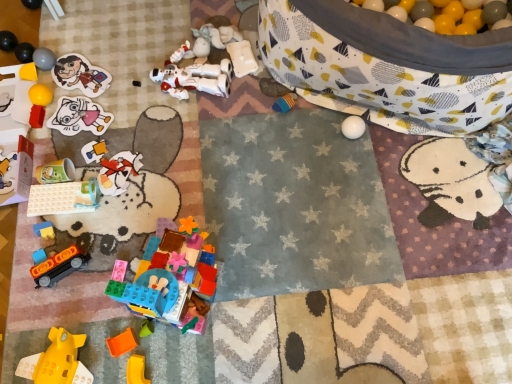
Question: From a real-world perspective, is matte paper sticker at upper left, positioned as the eleventh toy in bottom-to-top order, above or below matte plastic cup at lower left, positioned as the 9th toy in bottom-to-top order?

Choices:
 (A) below
 (B) above

Answer: (A)

Question: Would you say matte paper sticker at upper left, which ranks as the seventh toy in top-to-bottom order, is to the left or to the right of matte plastic cup at lower left, placed as the ninth toy when sorted from top to bottom, in the picture?

Choices:
 (A) left
 (B) right

Answer: (B)

Question: Which is farther from the translucent plastic cup at left, which appears as the eighth toy when viewed from the top?

Choices:
 (A) orange plastic block at lower left, the 3th toy positioned from the bottom
 (B) matte red toy at left, marked as the 6th toy in a top-to-bottom arrangement
 (C) matte gray ball at upper left, marked as the 3th toy in a top-to-bottom arrangement
 (D) translucent yellow plastic toy at lower left, arranged as the fourth toy when ordered from the bottom
 (E) white plastic building blocks at lower left, acting as the 8th toy starting from the bottom

Answer: (D)

Question: Which is nearer to the translucent yellow plastic toy at lower left, marked as the fourteenth toy in a top-to-bottom arrangement?

Choices:
 (A) translucent plastic building blocks at lower center, placed as the 12th toy when sorted from top to bottom
 (B) translucent plastic cup at left, the 10th toy ordered from the bottom
 (C) matte paper sticker at upper left, which is counted as the 13th toy, starting from the bottom
 (D) matte paper sticker at upper left, which ranks as the seventh toy in top-to-bottom order
 (E) yellow matte plastic block at lower left, the first toy positioned from the bottom

Answer: (E)